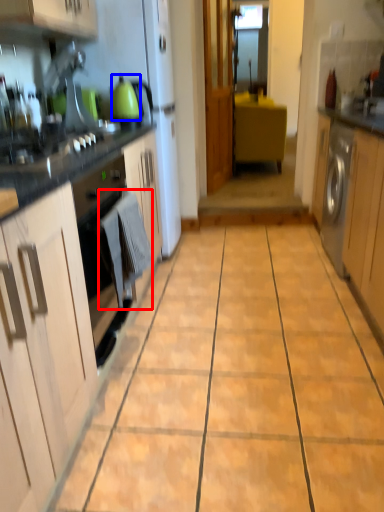
Question: Which object is closer to the camera taking this photo, laundry (highlighted by a red box) or kitchen appliance (highlighted by a blue box)?

Choices:
 (A) laundry
 (B) kitchen appliance

Answer: (A)